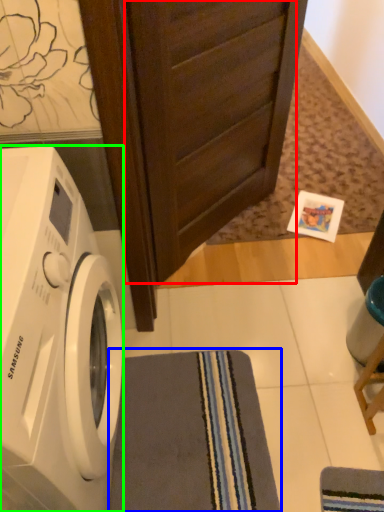
Question: Considering the real-world distances, which object is closest to screen door (highlighted by a red box)? bath towel (highlighted by a blue box) or washing machine (highlighted by a green box).

Choices:
 (A) bath towel
 (B) washing machine

Answer: (B)